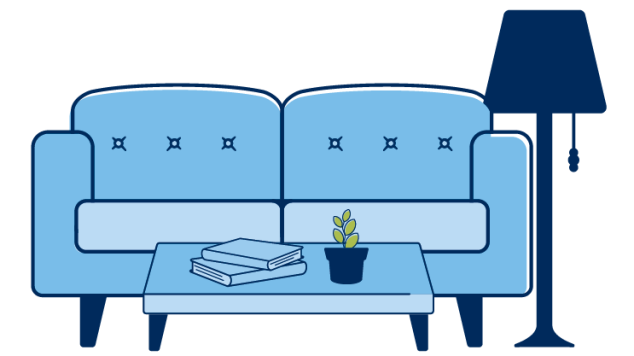
You are a GUI agent. You are given a task and a screenshot of the screen. Output one action in this format:
    pyautogui.click(x=<x>, y=<y>)
    Task: Click on the pull cord
    
    Given the screenshot: What is the action you would take?
    pyautogui.click(x=574, y=158)